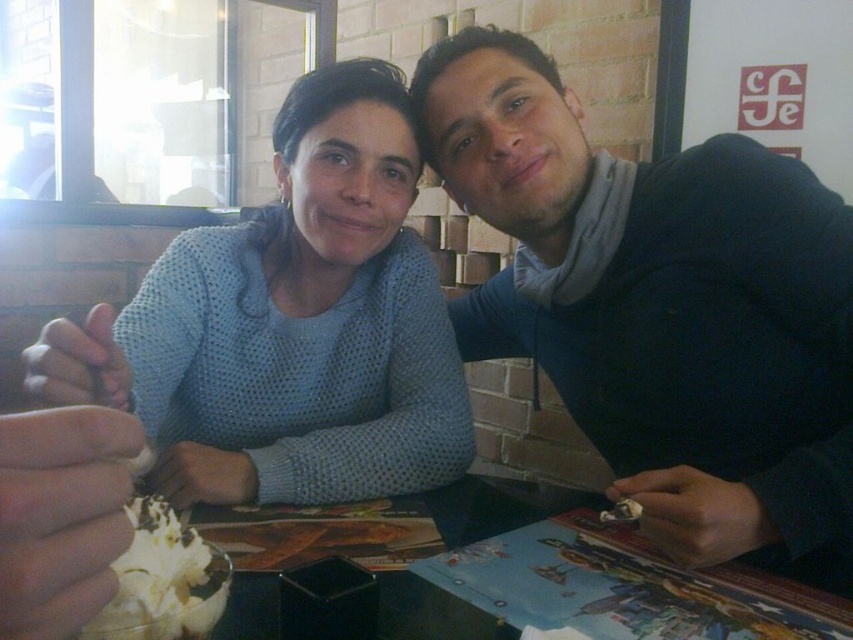
Is light blue knitted sweater at upper left below whipped cream at lower left?

Actually, light blue knitted sweater at upper left is above whipped cream at lower left.

Is light blue knitted sweater at upper left taller than whipped cream at lower left?

Correct, light blue knitted sweater at upper left is much taller as whipped cream at lower left.

Between point (212, 428) and point (125, 598), which one is positioned in front?

Point (125, 598) is in front.

I want to click on light blue knitted sweater at upper left, so click(x=289, y=324).